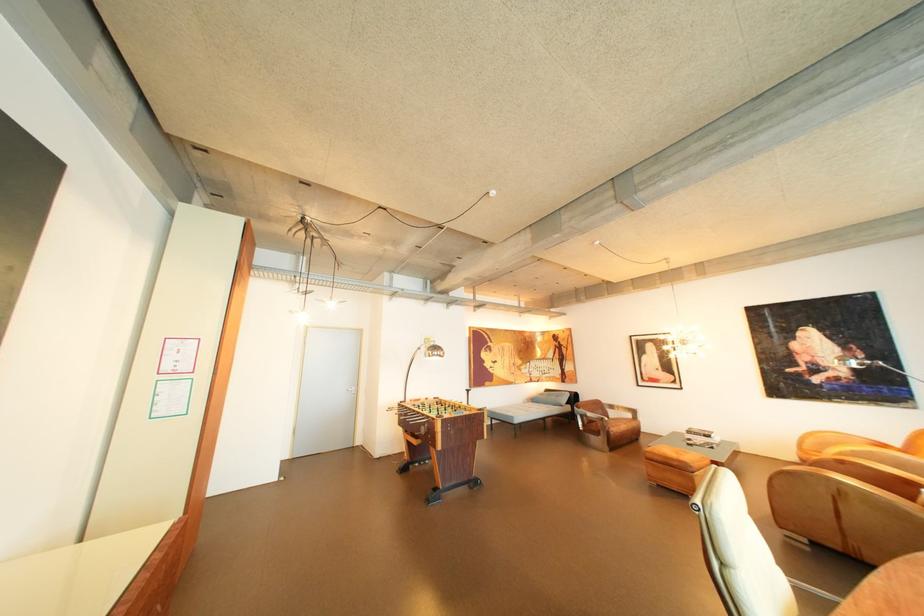
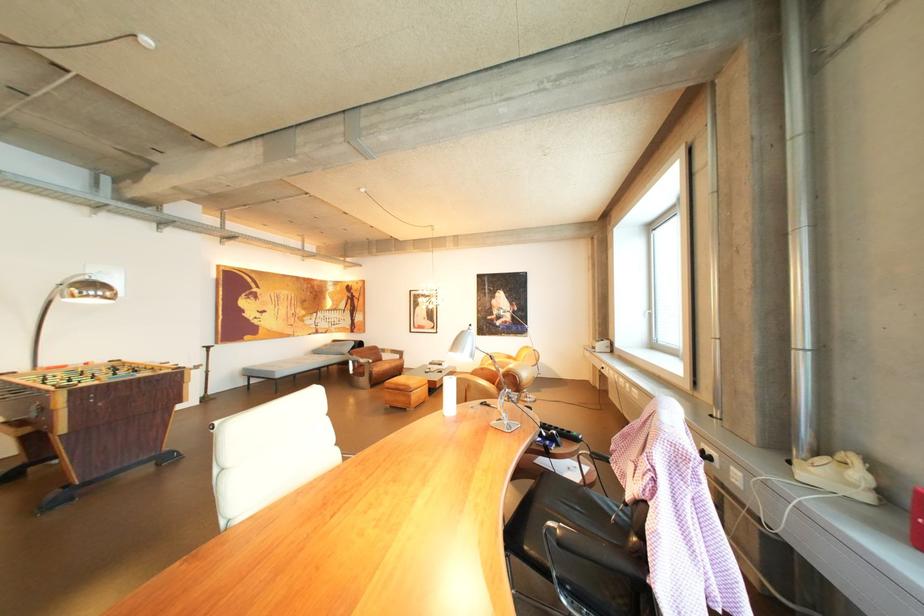
Find the pixel in the second image that matches (x=604, y=422) in the first image.

(374, 366)